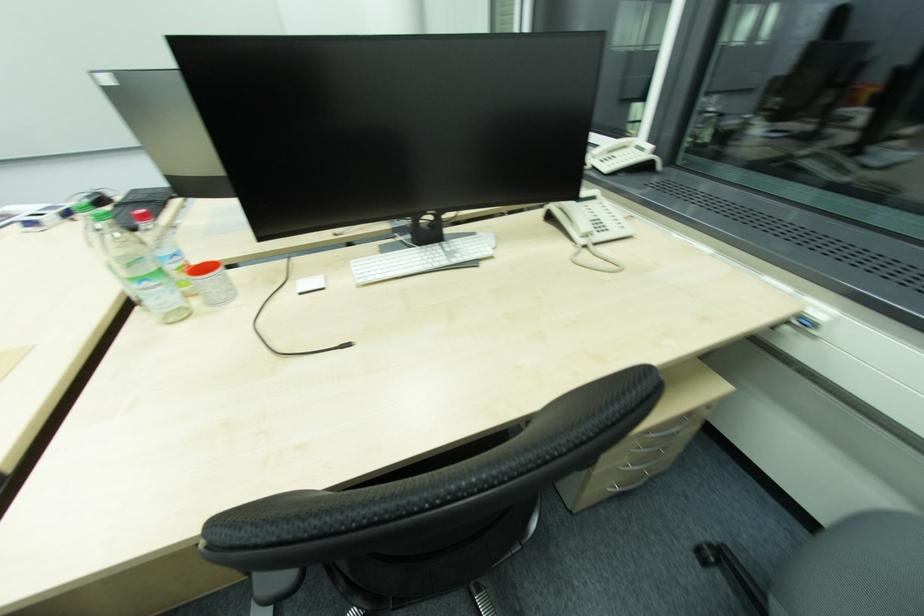
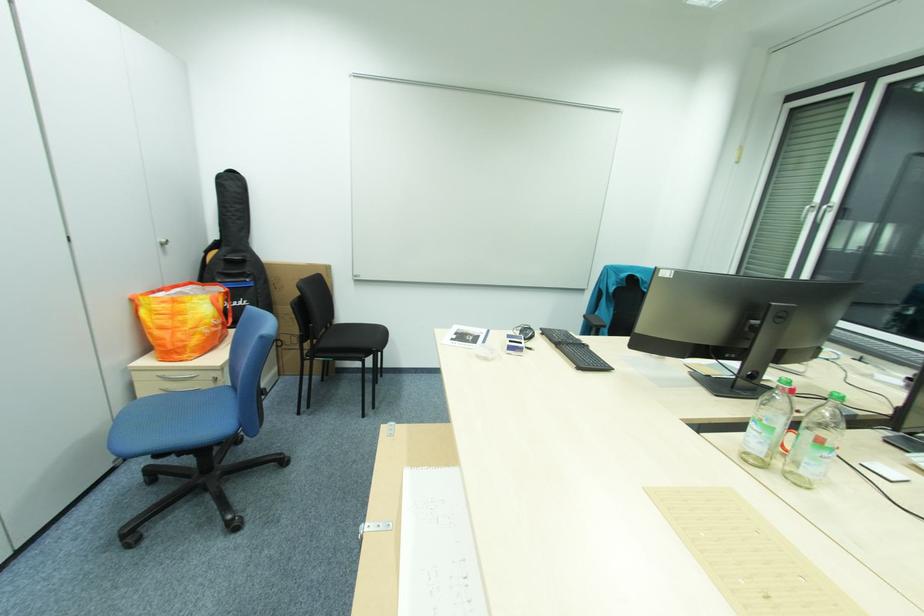
Question: What movement of the cameraman would produce the second image?

Choices:
 (A) Left
 (B) Right
 (C) Forward
 (D) Backward

Answer: (A)